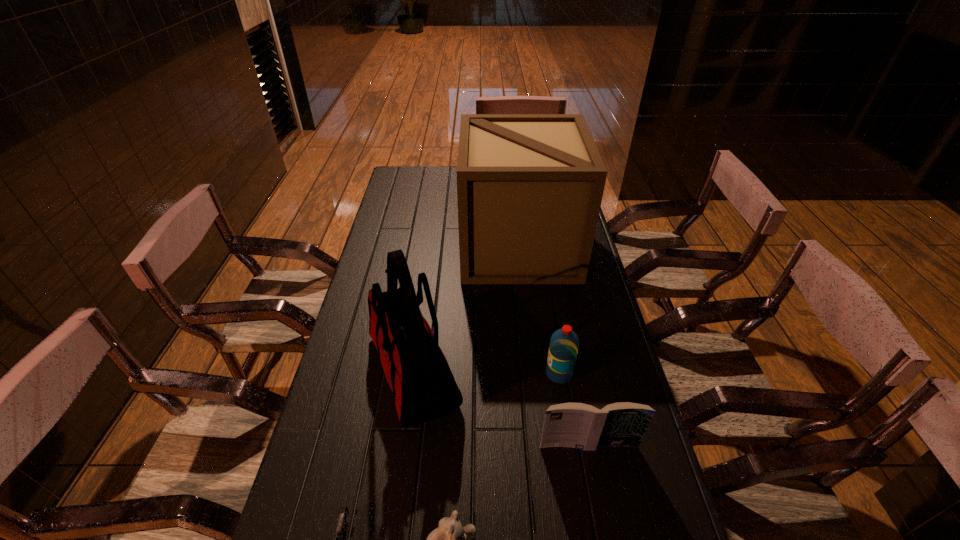
Locate an element on the screen. Image resolution: width=960 pixels, height=540 pixels. free space that is in between the duffel bag and the water bottle is located at coordinates (486, 372).

Identify which object is the third nearest to the teddy bear. Please provide its 2D coordinates. Your answer should be formatted as a tuple, i.e. [(x, y)], where the tuple contains the x and y coordinates of a point satisfying the conditions above.

[(577, 425)]

Identify which object is the third closest to the book. Please provide its 2D coordinates. Your answer should be formatted as a tuple, i.e. [(x, y)], where the tuple contains the x and y coordinates of a point satisfying the conditions above.

[(450, 539)]